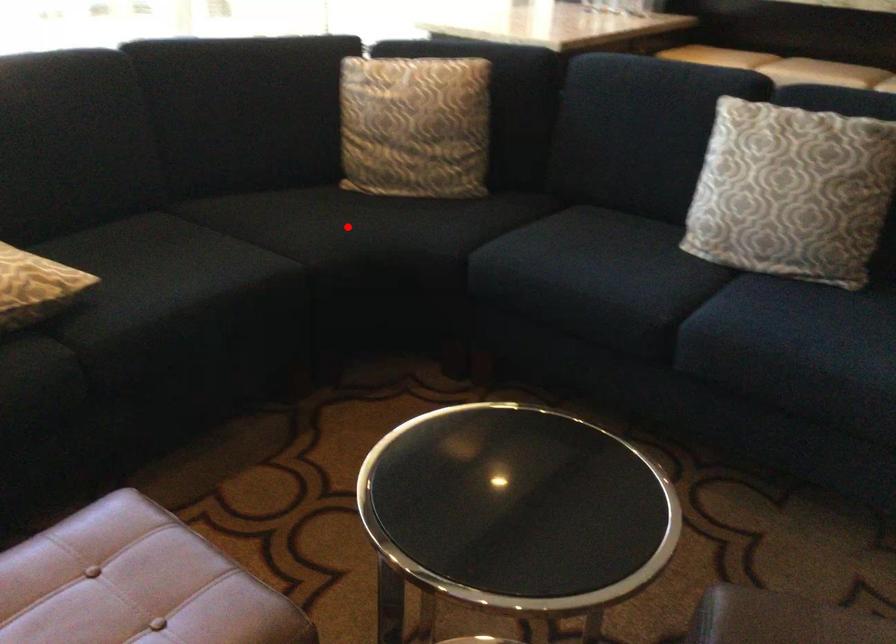
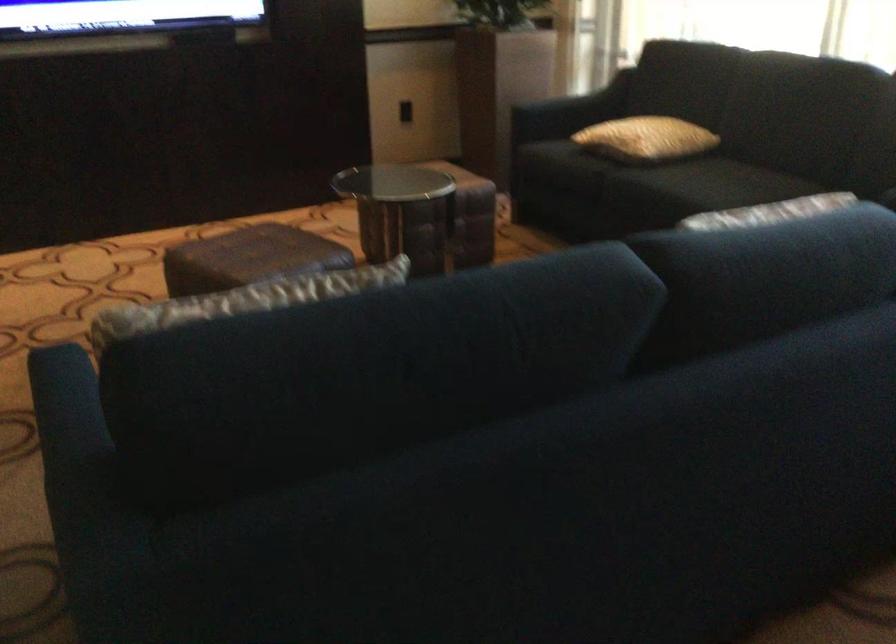
Question: I am providing you with two images of the same scene from different viewpoints. A red point is marked on the first image. At the location where the point appears in image 1, is it still visible in image 2?

Choices:
 (A) Yes
 (B) No

Answer: (B)